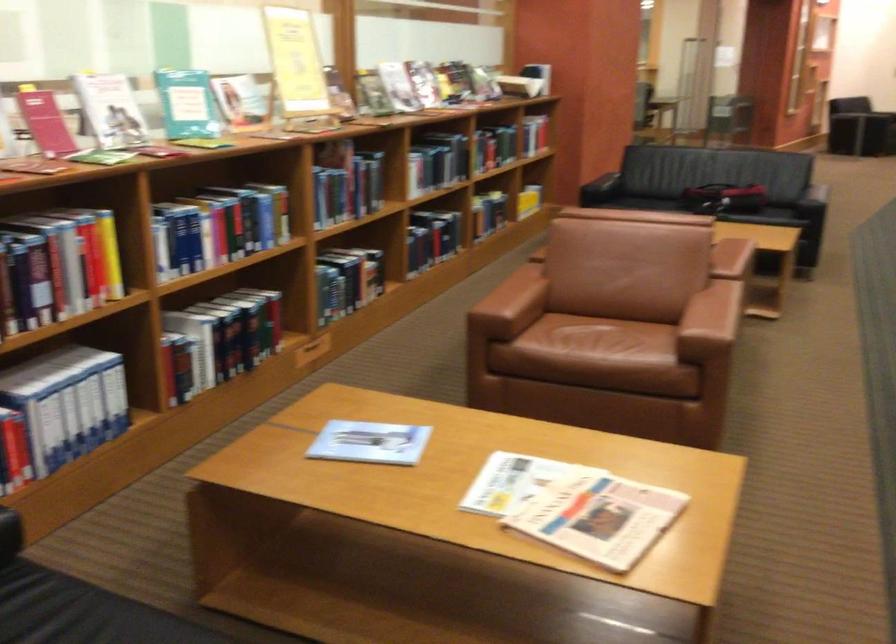
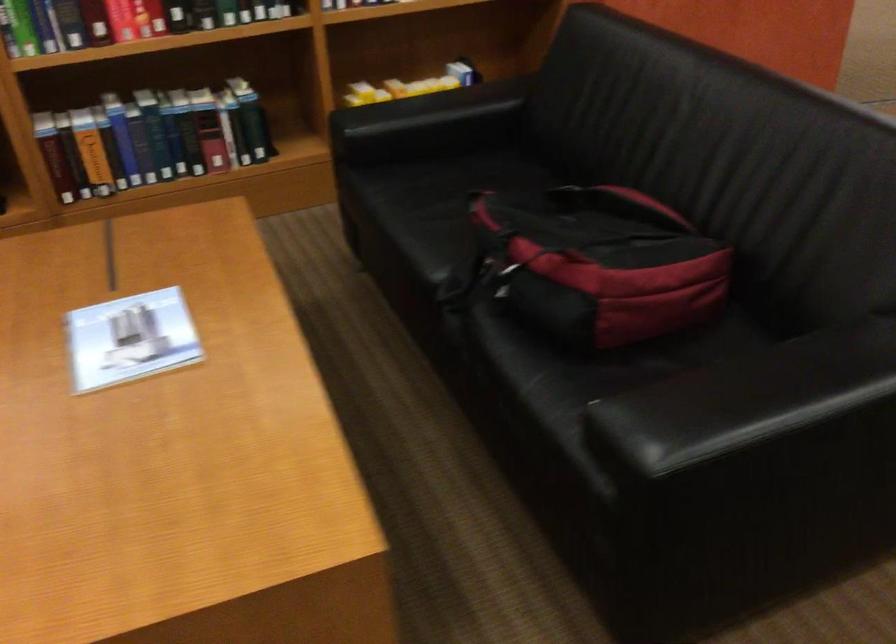
In the second image, find the point that corresponds to the point at 530,147 in the first image.

(350, 3)